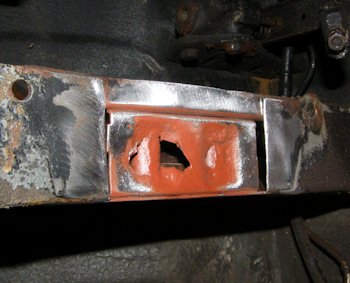
Locate an element on the screen. The height and width of the screenshot is (283, 350). metal rod going across is located at coordinates (203, 136).